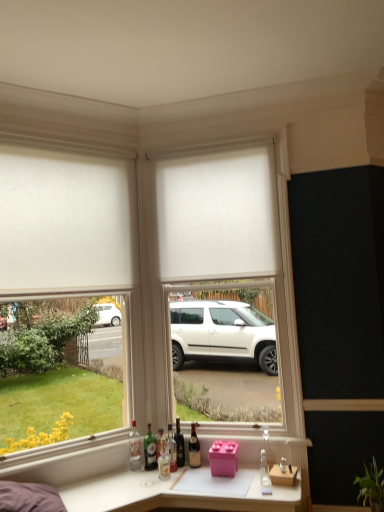
Find the location of a particular element. clear glass bottle at lower left, which is the 1th bottle from left to right is located at coordinates (134, 448).

Identify the location of clear glass bottle at center, the 3th bottle when ordered from left to right. (159, 442).

In order to face clear glass bottle at center, the 5th bottle viewed from the right, should I rotate leftwards or rightwards?

Turn left approximately 3.997 degrees to face it.

Describe the element at coordinates (150, 450) in the screenshot. This screenshot has width=384, height=512. I see `green glass bottle at lower center, marked as the sixth bottle in a right-to-left arrangement` at that location.

Where is `green glass bottle at lower center, marked as the sixth bottle in a right-to-left arrangement`? Image resolution: width=384 pixels, height=512 pixels. green glass bottle at lower center, marked as the sixth bottle in a right-to-left arrangement is located at coordinates (150, 450).

What are the coordinates of `translucent glass bottle at center, which ranks as the fourth bottle in left-to-right order` in the screenshot? It's located at (172, 449).

What is the approximate height of translucent glass bottle at center, which ranks as the fourth bottle in left-to-right order?

It is 12.54 inches.

Where is `clear glass bottle at lower left, positioned as the seventh bottle in right-to-left order`? clear glass bottle at lower left, positioned as the seventh bottle in right-to-left order is located at coordinates (134, 448).

You are a GUI agent. You are given a task and a screenshot of the screen. Output one action in this format:
    pyautogui.click(x=<x>, y=<y>)
    Task: Click on the blind above the clear glass bottle at lower left, which is the 1th bottle from left to right (from a real-world perspective)
    The image size is (384, 512).
    Given the screenshot: What is the action you would take?
    pyautogui.click(x=217, y=213)

Between white matte blind at center and clear glass bottle at lower left, which is the 1th bottle from left to right, which one appears on the left side from the viewer's perspective?

Positioned to the left is clear glass bottle at lower left, which is the 1th bottle from left to right.

Is white matte blind at center turned away from clear glass bottle at lower left, which is the 1th bottle from left to right?

No, white matte blind at center's orientation is not away from clear glass bottle at lower left, which is the 1th bottle from left to right.

Considering the positions of objects clear glass bottle at lower left, positioned as the seventh bottle in right-to-left order, and clear glass bottle at center, positioned as the seventh bottle in left-to-right order, in the image provided, who is in front, clear glass bottle at lower left, positioned as the seventh bottle in right-to-left order, or clear glass bottle at center, positioned as the seventh bottle in left-to-right order,?

Positioned in front is clear glass bottle at center, positioned as the seventh bottle in left-to-right order.

Is clear glass bottle at lower left, which is the 1th bottle from left to right, positioned beyond the bounds of clear glass bottle at center, which is counted as the first bottle, starting from the right?

Absolutely, clear glass bottle at lower left, which is the 1th bottle from left to right, is external to clear glass bottle at center, which is counted as the first bottle, starting from the right.

Is clear glass bottle at lower left, which is the 1th bottle from left to right, placed right next to clear glass bottle at center, positioned as the seventh bottle in left-to-right order?

No, clear glass bottle at lower left, which is the 1th bottle from left to right, is not beside clear glass bottle at center, positioned as the seventh bottle in left-to-right order.

From the picture: From the image's perspective, between white matte roller blind at upper left and clear glass bottle at center, positioned as the seventh bottle in left-to-right order, which one is located above?

From the image's view, white matte roller blind at upper left is above.

Is white matte roller blind at upper left far away from clear glass bottle at center, positioned as the seventh bottle in left-to-right order?

Yes, white matte roller blind at upper left is far from clear glass bottle at center, positioned as the seventh bottle in left-to-right order.

From a real-world perspective, who is located lower, white matte roller blind at upper left or clear glass bottle at center, positioned as the seventh bottle in left-to-right order?

From a 3D spatial view, clear glass bottle at center, positioned as the seventh bottle in left-to-right order, is below.

This screenshot has height=512, width=384. In order to click on window above the clear glass bottle at center, which is counted as the first bottle, starting from the right (from the image's perspective) in this screenshot , I will do coord(64,220).

How different are the orientations of white matte window frame at center and white matte roller blind at upper left in degrees?

48.1 degrees separate the facing orientations of white matte window frame at center and white matte roller blind at upper left.

Can you see white matte window frame at center touching white matte roller blind at upper left?

No, white matte window frame at center is not making contact with white matte roller blind at upper left.

Considering the positions of objects white matte window frame at center and white matte roller blind at upper left in the image provided, who is behind, white matte window frame at center or white matte roller blind at upper left?

white matte window frame at center is more distant.

Between point (293, 389) and point (109, 259), which one is positioned behind?

The point (109, 259) is farther.

From the image's perspective, is translucent glass bottle at center, which ranks as the fourth bottle in left-to-right order, above or below shiny dark brown bottle at center, the third bottle from the right?

Based on their image positions, translucent glass bottle at center, which ranks as the fourth bottle in left-to-right order, is located beneath shiny dark brown bottle at center, the third bottle from the right.

Is translucent glass bottle at center, which ranks as the fourth bottle in left-to-right order, aimed at shiny dark brown bottle at center, the third bottle from the right?

No, translucent glass bottle at center, which ranks as the fourth bottle in left-to-right order, is not oriented towards shiny dark brown bottle at center, the third bottle from the right.

Which is more to the left, translucent glass bottle at center, acting as the 4th bottle starting from the right, or shiny dark brown bottle at center, the third bottle from the right?

From the viewer's perspective, translucent glass bottle at center, acting as the 4th bottle starting from the right, appears more on the left side.

There is a shiny dark brown bottle at center, the third bottle from the right. Identify the location of the 2nd bottle below it (from a real-world perspective). (172, 449).

How distant is shiny dark brown bottle at center, the fifth bottle viewed from the left, from white matte roller blind at upper left?

shiny dark brown bottle at center, the fifth bottle viewed from the left, and white matte roller blind at upper left are 5.34 feet apart.

Between shiny dark brown bottle at center, the third bottle from the right, and white matte roller blind at upper left, which one has more height?

white matte roller blind at upper left.

Would you say shiny dark brown bottle at center, the third bottle from the right, is inside or outside white matte roller blind at upper left?

shiny dark brown bottle at center, the third bottle from the right, lies outside white matte roller blind at upper left.

What's the angular difference between shiny dark brown bottle at center, the third bottle from the right, and white matte roller blind at upper left's facing directions?

They differ by 40.7 degrees in their facing directions.

Which of these two, shiny dark brown bottle at center, the third bottle from the right, or brown glass bottle at center, marked as the sixth bottle in a left-to-right arrangement, is bigger?

With larger size is shiny dark brown bottle at center, the third bottle from the right.

Is shiny dark brown bottle at center, the third bottle from the right, looking in the opposite direction of brown glass bottle at center, marked as the sixth bottle in a left-to-right arrangement?

No, brown glass bottle at center, marked as the sixth bottle in a left-to-right arrangement, is not at the back of shiny dark brown bottle at center, the third bottle from the right.

Is point (184, 450) closer to viewer compared to point (195, 447)?

Yes, it is.

Based on the photo, from a real-world perspective, is shiny dark brown bottle at center, the fifth bottle viewed from the left, beneath brown glass bottle at center, marked as the 2th bottle in a right-to-left arrangement?

Actually, shiny dark brown bottle at center, the fifth bottle viewed from the left, is physically above brown glass bottle at center, marked as the 2th bottle in a right-to-left arrangement, in the real world.

Find the location of a particular element. The width and height of the screenshot is (384, 512). blind that is on the right side of clear glass bottle at lower left, positioned as the seventh bottle in right-to-left order is located at coordinates (217, 213).

From the image's perspective, which bottle is the 1st one below the clear glass bottle at center, which is counted as the first bottle, starting from the right? Please provide its 2D coordinates.

[(134, 448)]

Looking at the image, which one is located closer to translucent glass bottle at center, acting as the 4th bottle starting from the right, white matte window frame at center or clear glass bottle at center, the 5th bottle viewed from the right?

Among the two, clear glass bottle at center, the 5th bottle viewed from the right, is located nearer to translucent glass bottle at center, acting as the 4th bottle starting from the right.

Considering their positions, is white matte window frame at center positioned further to shiny dark brown bottle at center, the third bottle from the right, than white matte roller blind at upper left?

Based on the image, white matte roller blind at upper left appears to be further to shiny dark brown bottle at center, the third bottle from the right.

From the image, which object appears to be farther from clear glass bottle at center, which is counted as the first bottle, starting from the right, clear glass bottle at center, the 5th bottle viewed from the right, or shiny dark brown bottle at center, the fifth bottle viewed from the left?

clear glass bottle at center, the 5th bottle viewed from the right, lies further to clear glass bottle at center, which is counted as the first bottle, starting from the right, than the other object.

Based on their spatial positions, is translucent glass bottle at center, which ranks as the fourth bottle in left-to-right order, or shiny dark brown bottle at center, the third bottle from the right, closer to clear glass bottle at center, which is counted as the first bottle, starting from the right?

Among the two, shiny dark brown bottle at center, the third bottle from the right, is located nearer to clear glass bottle at center, which is counted as the first bottle, starting from the right.

Estimate the real-world distances between objects in this image. Which object is closer to white matte roller blind at upper left, white matte blind at center or translucent glass bottle at center, acting as the 4th bottle starting from the right?

white matte blind at center is closer to white matte roller blind at upper left.

Which object lies further to the anchor point shiny dark brown bottle at center, the third bottle from the right, brown glass bottle at center, marked as the 2th bottle in a right-to-left arrangement, or white matte roller blind at upper left?

Among the two, white matte roller blind at upper left is located further to shiny dark brown bottle at center, the third bottle from the right.

Based on their spatial positions, is clear glass bottle at center, the 5th bottle viewed from the right, or white matte window frame at center further from white matte roller blind at upper left?

clear glass bottle at center, the 5th bottle viewed from the right.

From the picture: From the image, which object appears to be nearer to brown glass bottle at center, marked as the 2th bottle in a right-to-left arrangement, translucent glass bottle at center, acting as the 4th bottle starting from the right, or clear glass bottle at lower left, which is the 1th bottle from left to right?

translucent glass bottle at center, acting as the 4th bottle starting from the right, lies closer to brown glass bottle at center, marked as the 2th bottle in a right-to-left arrangement, than the other object.

Where is `window frame between white matte roller blind at upper left and translucent glass bottle at center, which ranks as the fourth bottle in left-to-right order, in the up-down direction`? This screenshot has height=512, width=384. window frame between white matte roller blind at upper left and translucent glass bottle at center, which ranks as the fourth bottle in left-to-right order, in the up-down direction is located at coordinates (231, 230).

Locate an element on the screen. bottle between shiny dark brown bottle at center, the fifth bottle viewed from the left, and clear glass bottle at center, positioned as the seventh bottle in left-to-right order, from left to right is located at coordinates (194, 449).

Where is `window frame between white matte blind at center and brown glass bottle at center, marked as the sixth bottle in a left-to-right arrangement, in the vertical direction`? Image resolution: width=384 pixels, height=512 pixels. window frame between white matte blind at center and brown glass bottle at center, marked as the sixth bottle in a left-to-right arrangement, in the vertical direction is located at coordinates (231, 230).

Locate an element on the screen. This screenshot has width=384, height=512. window frame between white matte blind at center and clear glass bottle at lower left, positioned as the seventh bottle in right-to-left order, from top to bottom is located at coordinates (231, 230).